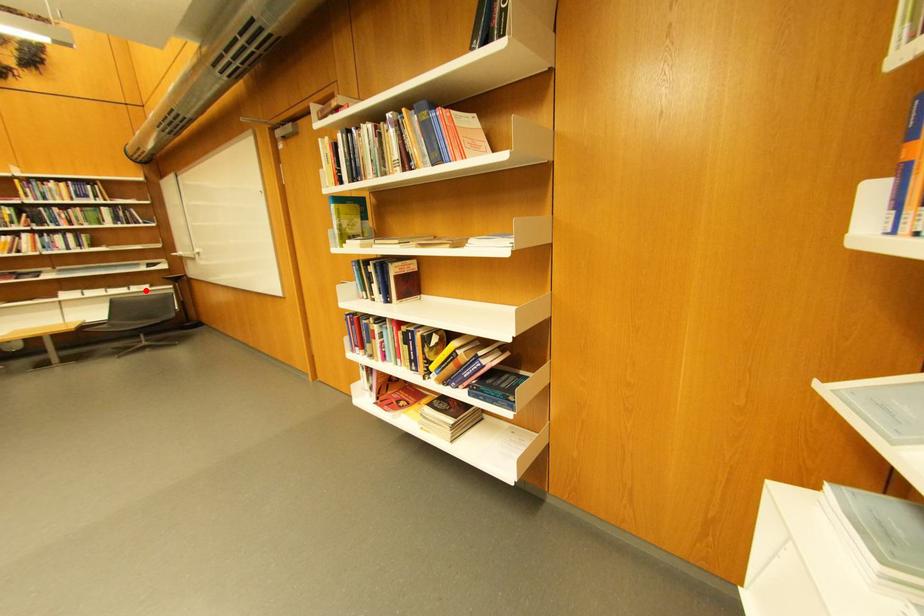
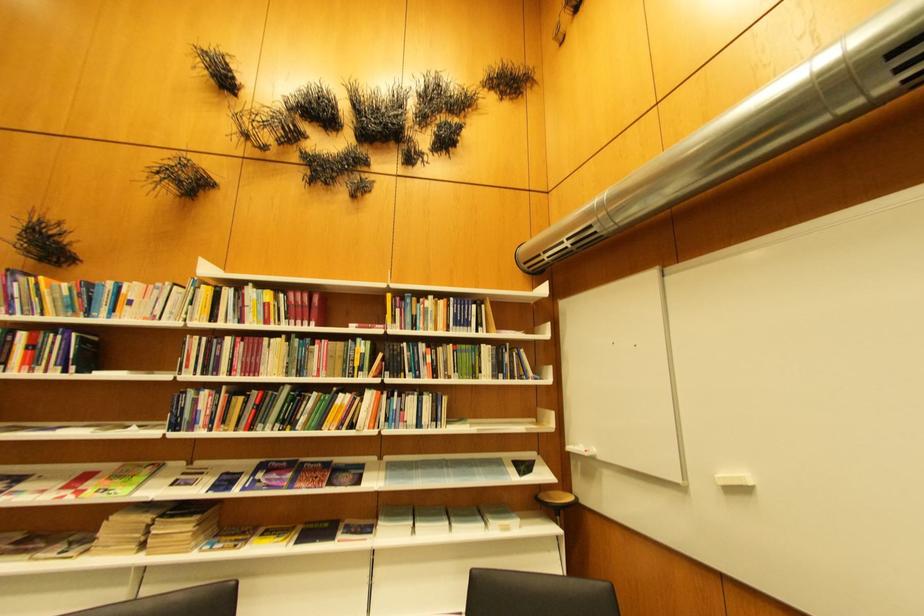
Find the pixel in the second image that matches the highlighted location in the first image.

(506, 530)